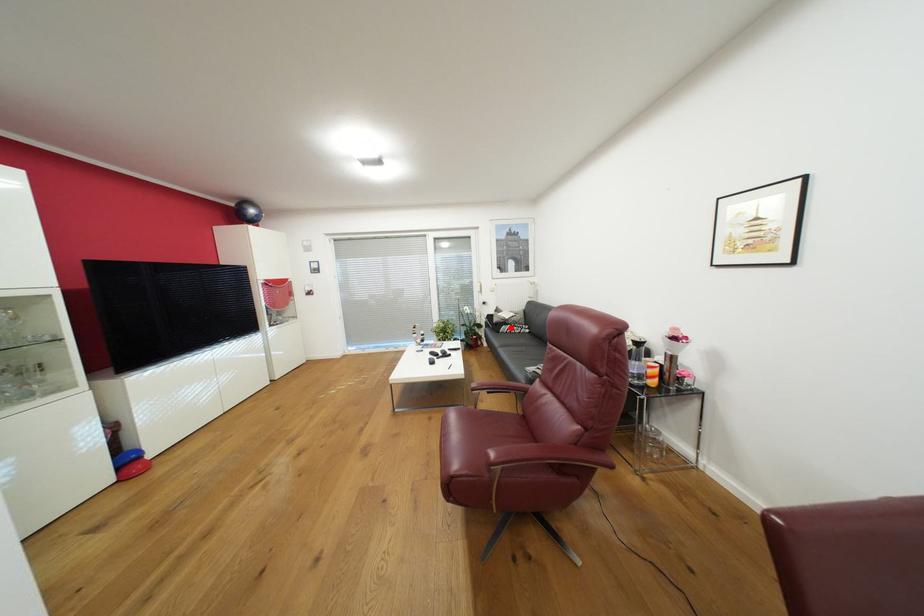
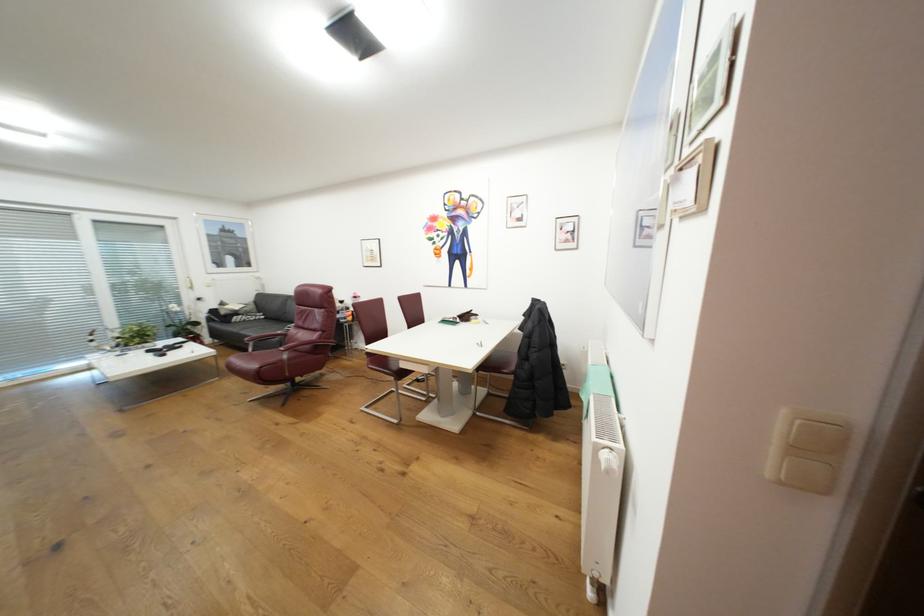
The point at the highlighted location is marked in the first image. Where is the corresponding point in the second image?

(244, 318)